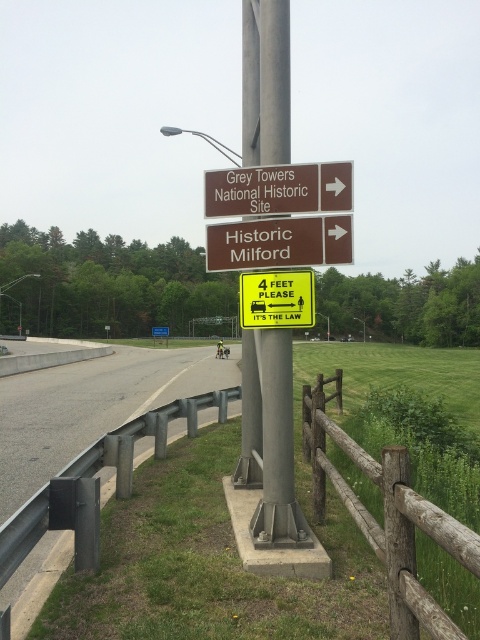
Question: Does metallic gray pole at center have a lesser width compared to brown wooden fence at lower right?

Choices:
 (A) yes
 (B) no

Answer: (B)

Question: In this image, where is metallic gray pole at center located relative to brown wooden sign at center?

Choices:
 (A) below
 (B) above

Answer: (B)

Question: Is metal guardrail at lower left bigger than yellow plastic sign at center?

Choices:
 (A) yes
 (B) no

Answer: (A)

Question: Which is farther from the brown wooden sign at upper center?

Choices:
 (A) brown wooden sign at center
 (B) yellow plastic sign at center

Answer: (B)

Question: Which of the following is the closest to the observer?

Choices:
 (A) metallic gray pole at center
 (B) brown wooden sign at upper center
 (C) brown wooden fence at lower right

Answer: (B)

Question: Which point appears farthest from the camera in this image?

Choices:
 (A) (227, 412)
 (B) (470, 561)
 (C) (300, 256)

Answer: (A)